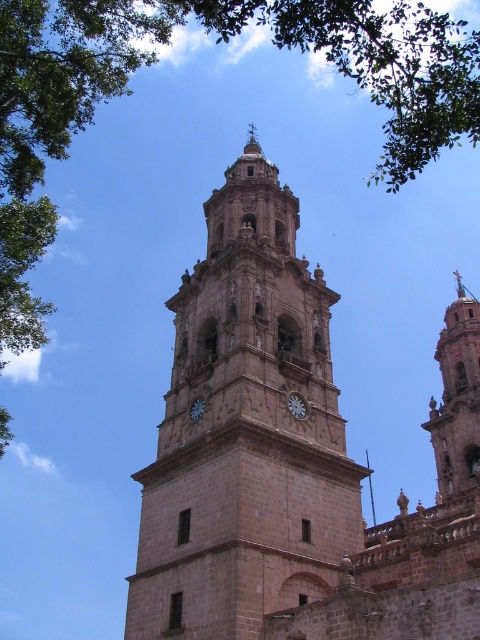
You are standing in a square in front of the brown stone clock tower at center and the green leafy tree at upper left. Which one appears taller from your vantage point?

The green leafy tree at upper left appears taller than the brown stone clock tower at center from your vantage point.

You are a tourist standing in front of the bell tower and want to take a photo that includes both the smooth stone tower at right and the matte gray clock at center. Which object should you focus on first to ensure both are in the frame?

You should focus on the matte gray clock at center first because it is shorter than the smooth stone tower at right, so centering it will help include both in the photo.